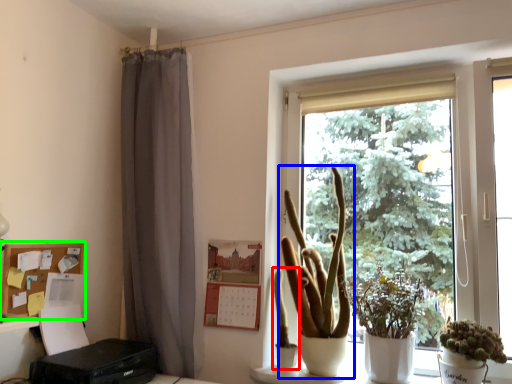
Question: Which object is the farthest from plant (highlighted by a red box)? Choose among these: houseplant (highlighted by a blue box) or shelf (highlighted by a green box).

Choices:
 (A) houseplant
 (B) shelf

Answer: (B)